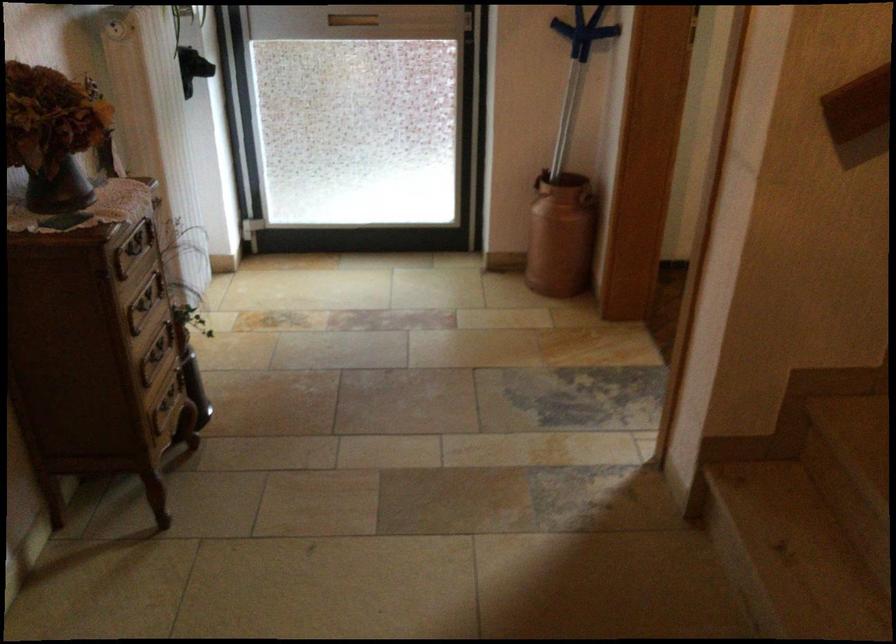
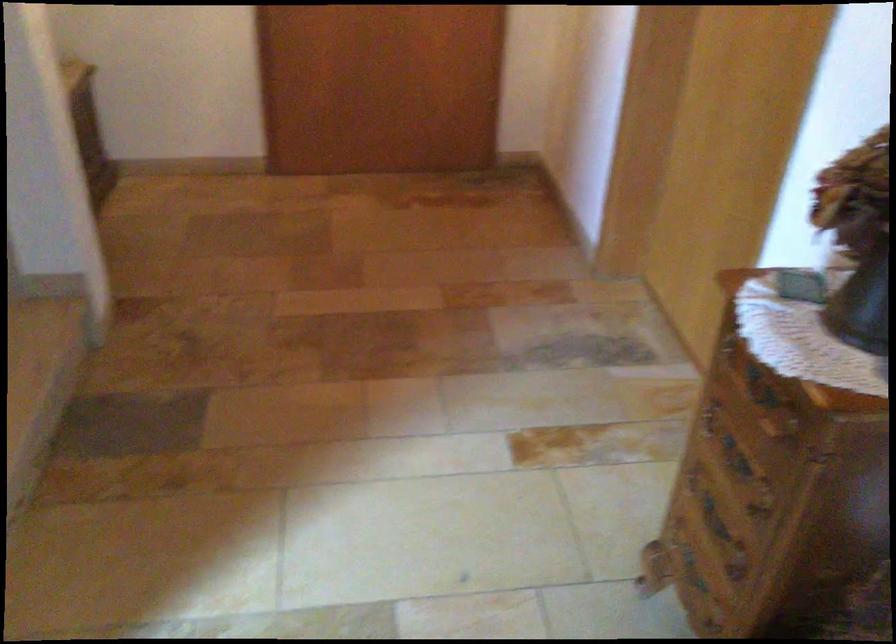
In the second image, find the point that corresponds to pixel 159 449 in the first image.

(693, 571)